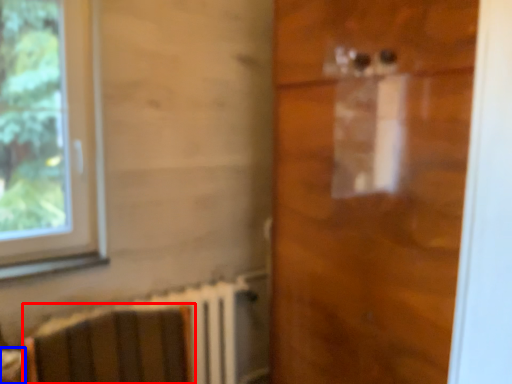
Question: Which object appears closest to the camera in this image, armchair (highlighted by a red box) or table (highlighted by a blue box)?

Choices:
 (A) armchair
 (B) table

Answer: (A)